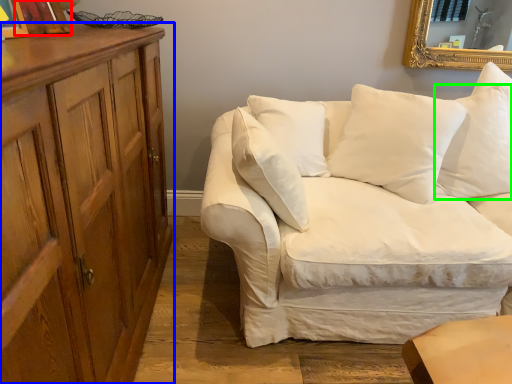
Question: Considering the real-world distances, which object is closest to picture frame (highlighted by a red box)? cabinetry (highlighted by a blue box) or pillow (highlighted by a green box).

Choices:
 (A) cabinetry
 (B) pillow

Answer: (A)